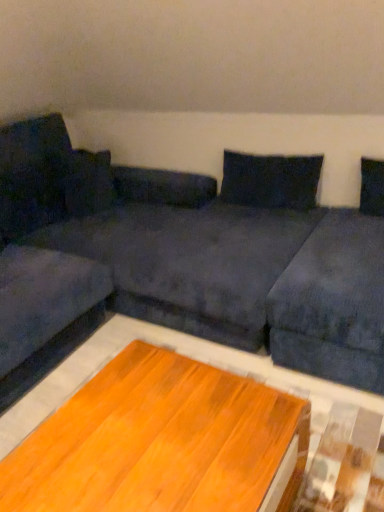
Question: Visually, is dark blue fabric pillow at upper center positioned to the left or to the right of dark blue fabric couch at center?

Choices:
 (A) right
 (B) left

Answer: (A)

Question: Considering the positions of dark blue fabric pillow at upper center and dark blue fabric couch at center in the image, is dark blue fabric pillow at upper center wider or thinner than dark blue fabric couch at center?

Choices:
 (A) wide
 (B) thin

Answer: (B)

Question: Which object is the farthest from the dark blue fabric couch at center?

Choices:
 (A) velvet dark blue couch at left
 (B) wooden table at center
 (C) dark blue fabric pillow at upper center

Answer: (B)

Question: Which of these objects is positioned closest to the velvet dark blue couch at left?

Choices:
 (A) dark blue fabric pillow at upper center
 (B) dark blue fabric couch at center
 (C) wooden table at center

Answer: (B)